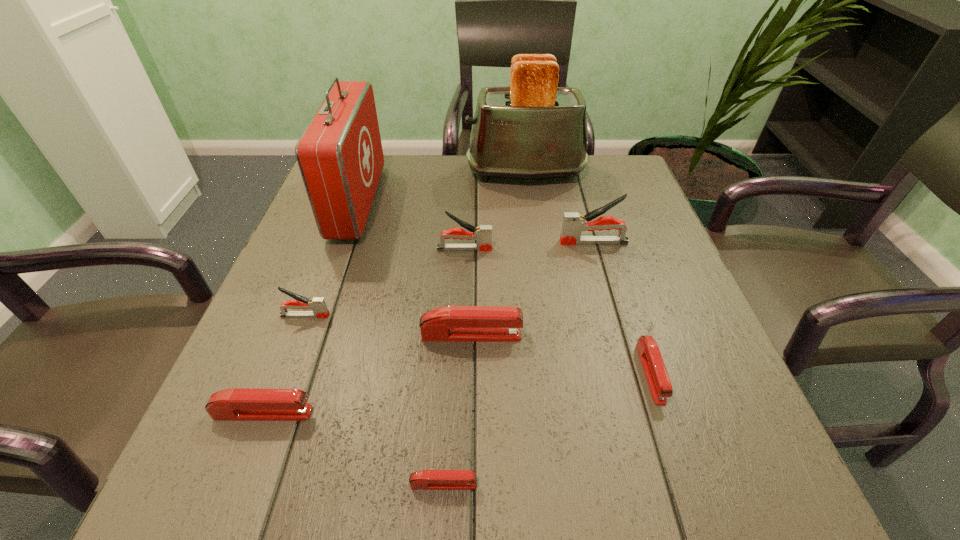
The image size is (960, 540). I want to click on the leftmost red stapler, so click(x=238, y=404).

Identify the location of the third smallest red stapler. The image size is (960, 540). (238, 404).

This screenshot has width=960, height=540. What are the coordinates of `the third nearest red stapler` in the screenshot? It's located at [x=660, y=386].

Where is `the rightmost red stapler`? The image size is (960, 540). the rightmost red stapler is located at coordinates (660, 386).

What are the coordinates of `the nearest stapler` in the screenshot? It's located at 426,479.

The width and height of the screenshot is (960, 540). I want to click on the shortest stapler, so click(x=426, y=479).

Where is `blank space located 0.220m on the side of the toaster with the control lever`? blank space located 0.220m on the side of the toaster with the control lever is located at coordinates (386, 172).

The width and height of the screenshot is (960, 540). I want to click on vacant region located on the side of the toaster with the control lever, so pos(360,172).

I want to click on free spot located on the side of the toaster with the control lever, so click(400, 172).

What are the coordinates of `vacant position located 0.200m on the side of the first-aid kit with the first aid cross symbol` in the screenshot? It's located at (455, 202).